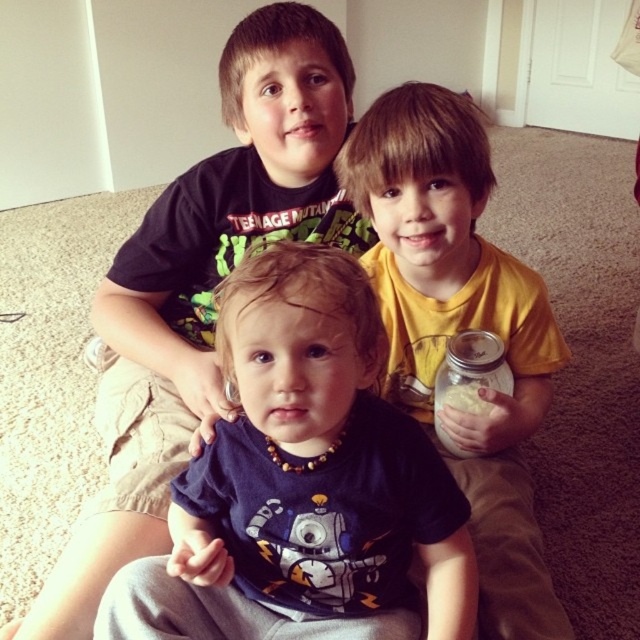
Can you confirm if robot t-shirt at center is thinner than yellow matte shirt at center?

In fact, robot t-shirt at center might be wider than yellow matte shirt at center.

Is robot t-shirt at center to the right of yellow matte shirt at center from the viewer's perspective?

Incorrect, robot t-shirt at center is not on the right side of yellow matte shirt at center.

Does point (232, 321) lie in front of point (397, 305)?

Yes.

At what (x,y) coordinates should I click in order to perform the action: click on robot t-shirt at center. Please return your answer as a coordinate pair (x, y). The image size is (640, 640). Looking at the image, I should click on (304, 483).

Is blue fabric shirt at center smaller than clear glass jar at center?

Actually, blue fabric shirt at center might be larger than clear glass jar at center.

Is point (323, 134) positioned in front of point (493, 353)?

No, (323, 134) is behind (493, 353).

Identify the location of blue fabric shirt at center. The image size is (640, 640). (202, 285).

Does robot t-shirt at center lie in front of clear glass jar at center?

That is True.

From the picture: Is robot t-shirt at center smaller than clear glass jar at center?

Actually, robot t-shirt at center might be larger than clear glass jar at center.

Between point (284, 269) and point (444, 356), which one is positioned in front?

Point (284, 269) is in front.

This screenshot has height=640, width=640. Identify the location of robot t-shirt at center. (304, 483).